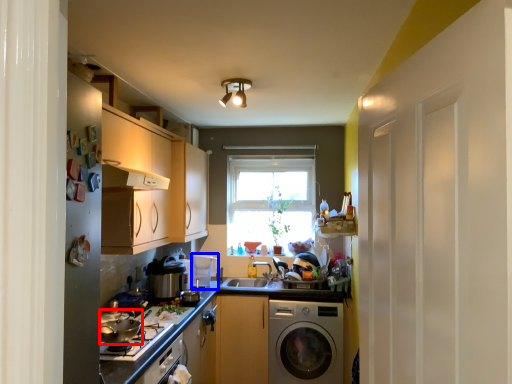
Question: Among these objects, which one is farthest to the camera, appliance (highlighted by a red box) or appliance (highlighted by a blue box)?

Choices:
 (A) appliance
 (B) appliance

Answer: (B)